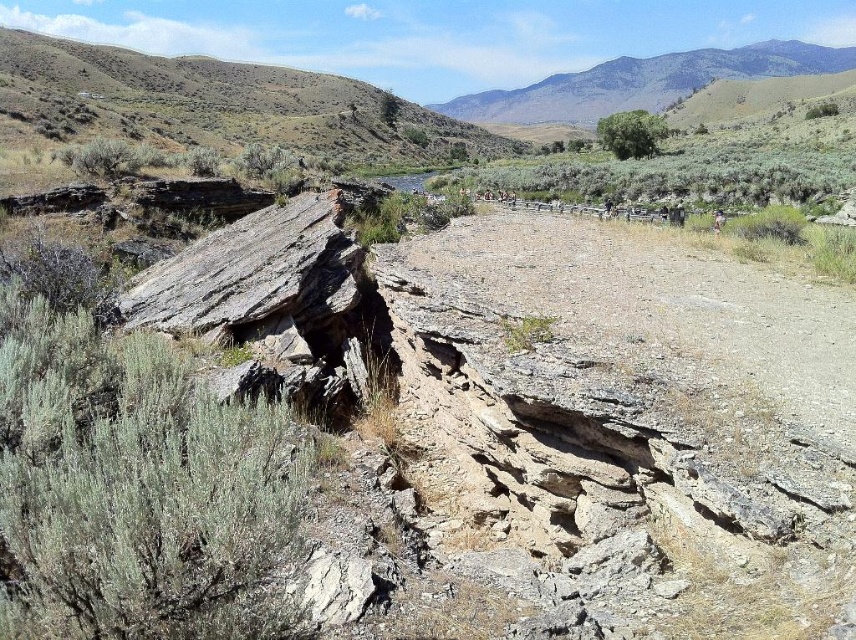
Which is more to the right, gray rocky mountain at upper center or green leafy tree at upper center?

gray rocky mountain at upper center

What do you see at coordinates (643, 83) in the screenshot?
I see `gray rocky mountain at upper center` at bounding box center [643, 83].

The width and height of the screenshot is (856, 640). In order to click on gray rocky mountain at upper center in this screenshot , I will do `click(643, 83)`.